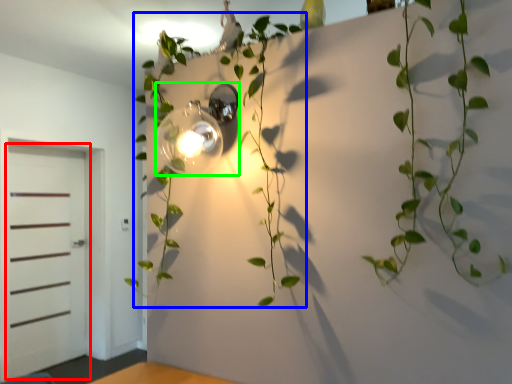
Question: Estimate the real-world distances between objects in this image. Which object is farther from door (highlighted by a red box), plant (highlighted by a blue box) or light fixture (highlighted by a green box)?

Choices:
 (A) plant
 (B) light fixture

Answer: (B)